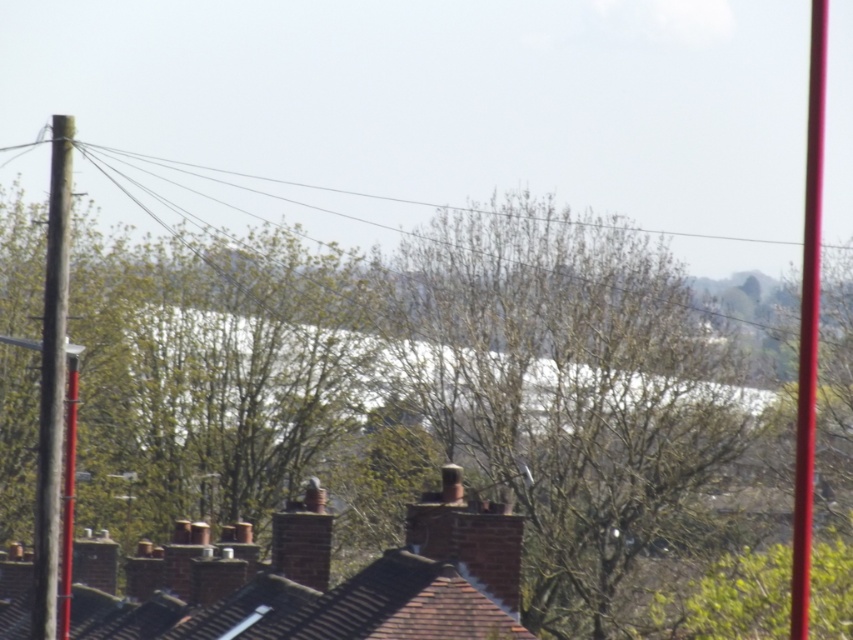
Question: Does green leafy tree at center have a greater width compared to smooth glossy pole at right?

Choices:
 (A) yes
 (B) no

Answer: (A)

Question: Does smooth wooden pole at left appear under smooth glossy pole at right?

Choices:
 (A) no
 (B) yes

Answer: (B)

Question: Is green leafy tree at center above smooth glossy pole at right?

Choices:
 (A) yes
 (B) no

Answer: (B)

Question: Estimate the real-world distances between objects in this image. Which object is farther from the smooth wooden pole at left?

Choices:
 (A) green leafy tree at center
 (B) smooth glossy pole at right

Answer: (B)

Question: Which of the following is the closest to the observer?

Choices:
 (A) (805, 522)
 (B) (39, 490)
 (C) (207, 595)

Answer: (A)

Question: Which of the following is the farthest from the observer?

Choices:
 (A) smooth glossy pole at right
 (B) smooth wooden pole at left

Answer: (B)